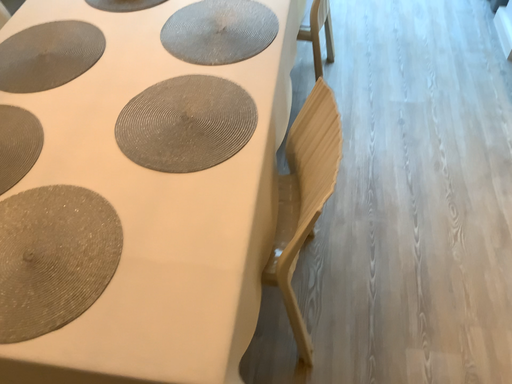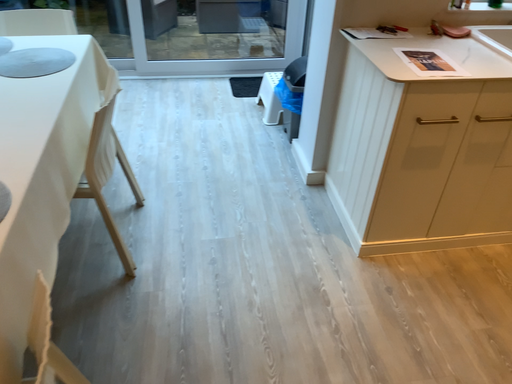
Question: Which way did the camera rotate in the video?

Choices:
 (A) rotated downward
 (B) rotated upward

Answer: (B)